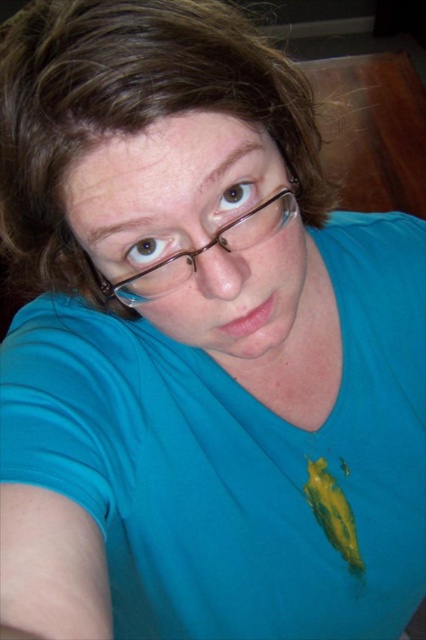
The person in the image is trying to decide whether to place a decorative item that is 10 cm wide on their desk. They have both the brownhair at center and the clear plastic glasses at center nearby. Based on their sizes, which object can the decorative item fit next to without overlapping?

The decorative item that is 10 cm wide can fit next to the clear plastic glasses at center because the brownhair at center is wider than the clear plastic glasses at center, making the glasses a better fit for the item.

You are a photographer setting up a portrait shoot. The subject has brownhair at center and clear plastic glasses at center. Based on the scene, will the glasses be visible in the final photo?

The brownhair at center is positioned over clear plastic glasses at center, so the glasses may be partially or fully obscured by the hair, making them less visible in the photo.